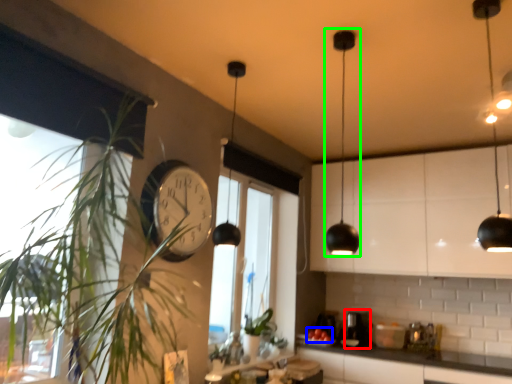
Question: Based on their relative distances, which object is nearer to coffee machine (highlighted by a red box)? Choose from fruit (highlighted by a blue box) and light (highlighted by a green box).

Choices:
 (A) fruit
 (B) light

Answer: (A)